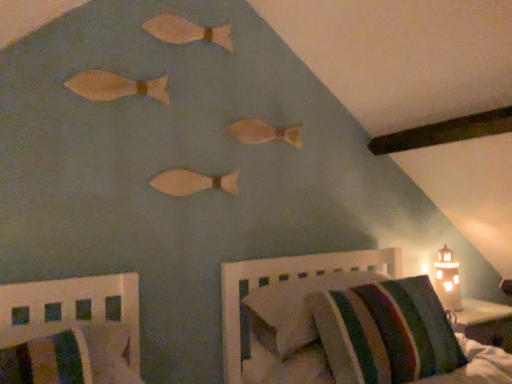
Question: From the image's perspective, is striped fabric pillow at lower right above or below striped fabric chair at lower left, which ranks as the 1th furniture in left-to-right order?

Choices:
 (A) above
 (B) below

Answer: (A)

Question: Is striped fabric pillow at lower right inside or outside of striped fabric chair at lower left, arranged as the 2th furniture when viewed from the right?

Choices:
 (A) outside
 (B) inside

Answer: (A)

Question: Based on their relative distances, which object is farther from the wooden fish at center, which is the third animal from top to bottom?

Choices:
 (A) striped fabric pillow at lower right
 (B) white ceramic table lamp at lower right
 (C) matte wooden fish at upper left, placed as the second animal when sorted from top to bottom
 (D) matte wooden fish at center, marked as the 4th animal in a top-to-bottom arrangement
 (E) striped fabric chair at lower left, arranged as the 2th furniture when viewed from the right

Answer: (B)

Question: Based on their relative distances, which object is farther from the matte wooden fish at center, which appears as the first animal when ordered from the bottom?

Choices:
 (A) striped fabric chair at lower left, which ranks as the 1th furniture in left-to-right order
 (B) wooden lighthouse at right, positioned as the 2th furniture in left-to-right order
 (C) striped fabric mattress at lower right
 (D) wooden fish at upper center, placed as the 1th animal when sorted from top to bottom
 (E) wooden fish at center, which is the third animal from top to bottom

Answer: (C)